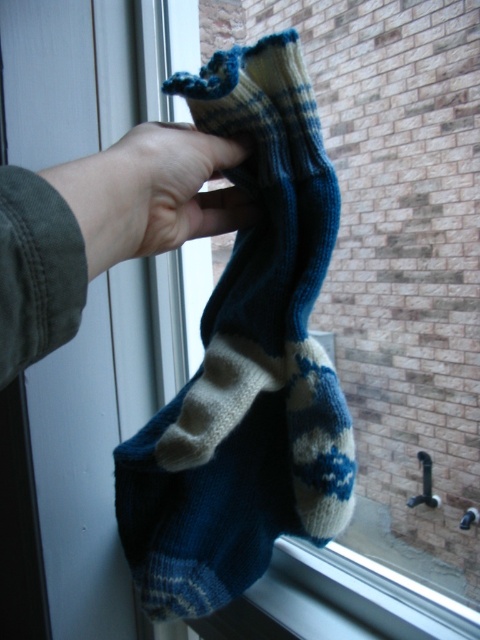
Question: Which point appears farthest from the camera in this image?

Choices:
 (A) (199, 170)
 (B) (180, 422)

Answer: (B)

Question: Can you confirm if blue knitted sock at upper center is smaller than skinny white hand at center?

Choices:
 (A) no
 (B) yes

Answer: (A)

Question: Does blue knitted sock at upper center have a greater width compared to skinny white hand at center?

Choices:
 (A) no
 (B) yes

Answer: (B)

Question: Is blue knitted sock at upper center in front of skinny white hand at center?

Choices:
 (A) yes
 (B) no

Answer: (B)

Question: Which point is farther to the camera?

Choices:
 (A) skinny white hand at center
 (B) blue knitted sock at upper center

Answer: (B)

Question: Which point is closer to the camera?

Choices:
 (A) (149, 227)
 (B) (249, 573)

Answer: (A)